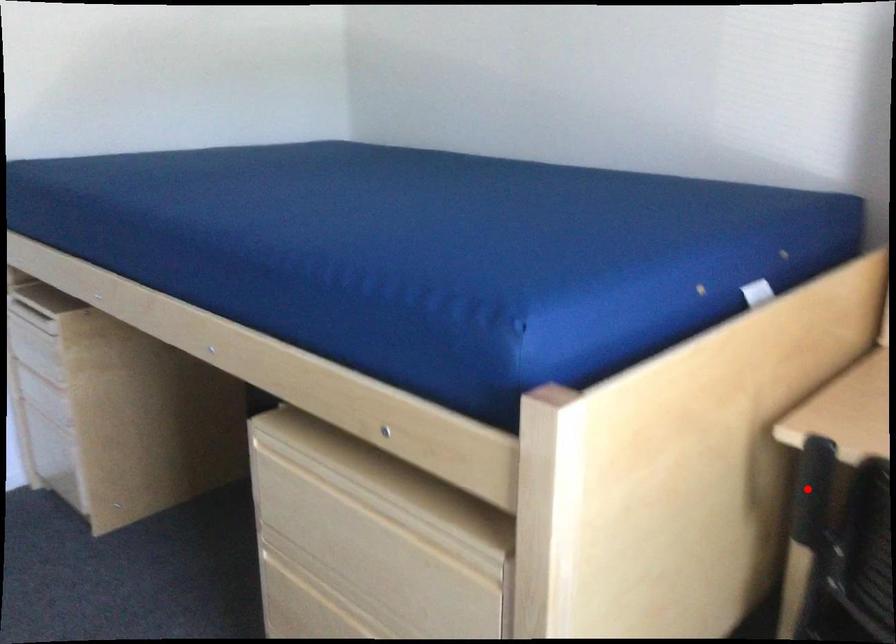
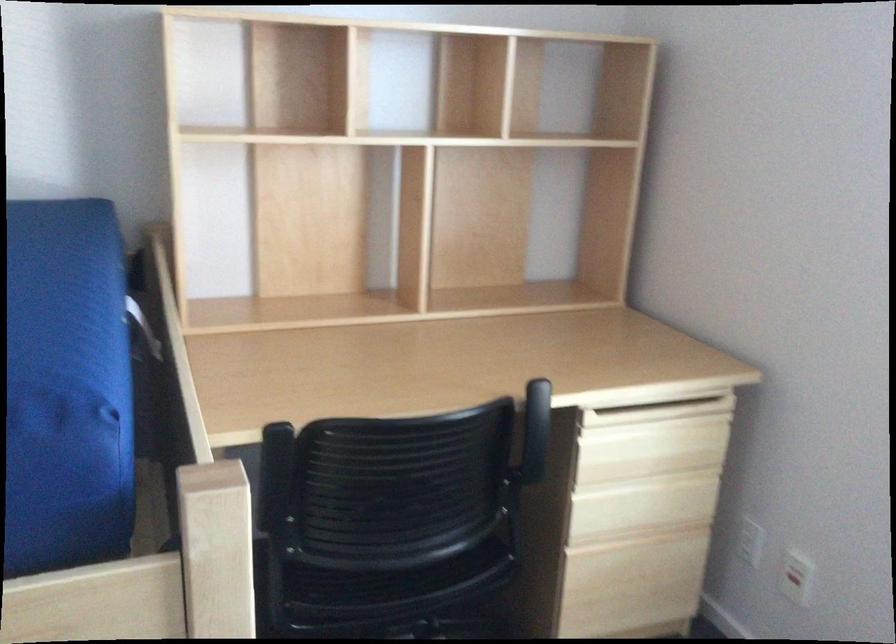
Locate, in the second image, the point that corresponds to the highlighted location in the first image.

(273, 474)